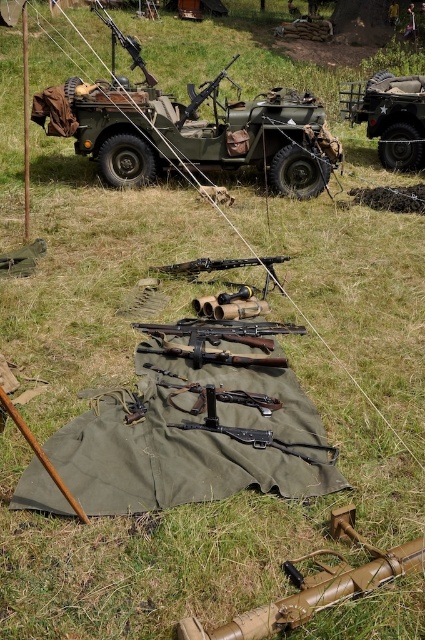
Can you confirm if green matte military vehicle at center is positioned below matte black rifle at center?

Yes.

Is green matte military vehicle at center bigger than matte black rifle at center?

No, green matte military vehicle at center is not bigger than matte black rifle at center.

Image resolution: width=425 pixels, height=640 pixels. What do you see at coordinates (189, 128) in the screenshot? I see `green matte military vehicle at center` at bounding box center [189, 128].

Identify the location of green matte military vehicle at center. (189, 128).

Describe the element at coordinates (189, 128) in the screenshot. I see `green matte military vehicle at center` at that location.

Where is `green matte military vehicle at center`? This screenshot has height=640, width=425. green matte military vehicle at center is located at coordinates (189, 128).

Who is shorter, matte black machine gun at center or brown wood pole at left?

With less height is matte black machine gun at center.

Is matte black machine gun at center positioned behind brown wood pole at left?

No.

Is point (195, 269) more distant than point (23, 152)?

No, (195, 269) is in front of (23, 152).

What are the coordinates of `matte black machine gun at center` in the screenshot? It's located at (221, 268).